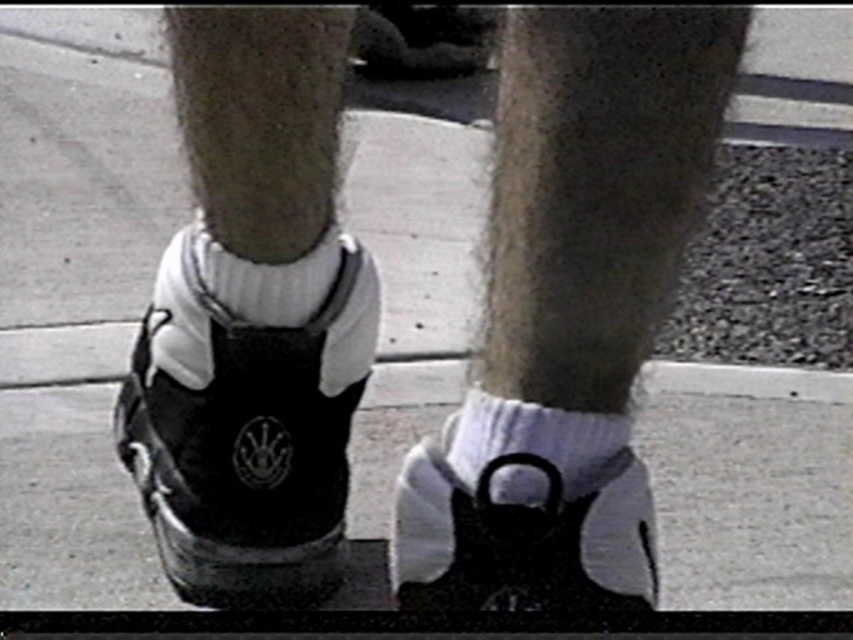
Question: Estimate the real-world distances between objects in this image. Which object is farther from the white cotton sock at center?

Choices:
 (A) white matte socks at lower center
 (B) black matte sneaker at center
 (C) white soft sock at center
 (D) black matte shoe at lower center

Answer: (D)

Question: Which object is the closest to the white matte socks at lower center?

Choices:
 (A) white cotton sock at center
 (B) black matte shoe at lower center
 (C) white soft sock at center
 (D) black matte sneaker at center

Answer: (B)

Question: Is black matte sneaker at center below white cotton sock at center?

Choices:
 (A) yes
 (B) no

Answer: (A)

Question: Estimate the real-world distances between objects in this image. Which object is closer to the black matte sneaker at center?

Choices:
 (A) white matte socks at lower center
 (B) white cotton sock at center
 (C) white soft sock at center
 (D) black matte shoe at lower center

Answer: (B)

Question: Can you confirm if black matte sneaker at center is smaller than white cotton sock at center?

Choices:
 (A) yes
 (B) no

Answer: (B)

Question: Can you confirm if white matte socks at lower center is bigger than white soft sock at center?

Choices:
 (A) yes
 (B) no

Answer: (A)